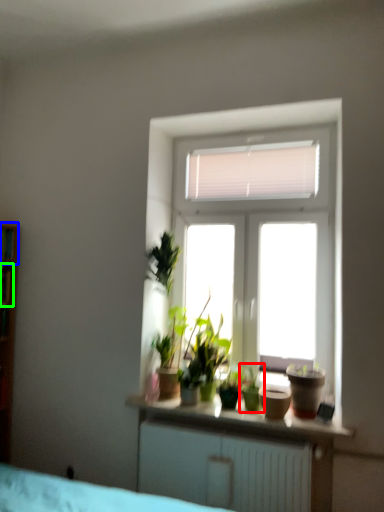
Question: Which object is positioned closest to houseplant (highlighted by a red box)? Select from shelf (highlighted by a blue box) and window (highlighted by a green box).

Choices:
 (A) shelf
 (B) window

Answer: (B)